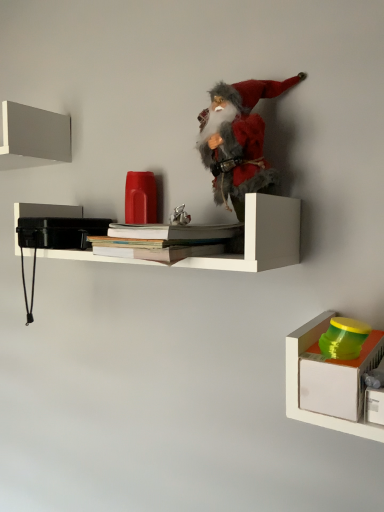
The image size is (384, 512). What do you see at coordinates (33, 137) in the screenshot?
I see `matte gray shelf at upper left, the first shelf positioned from the left` at bounding box center [33, 137].

The width and height of the screenshot is (384, 512). What do you see at coordinates (174, 231) in the screenshot? I see `white paper book at center, which appears as the second book when ordered from the bottom` at bounding box center [174, 231].

How much space does fuzzy fabric santa at center, which ranks as the first toy in top-to-bottom order, occupy horizontally?

fuzzy fabric santa at center, which ranks as the first toy in top-to-bottom order, is 13.92 centimeters in width.

How much space does hardcover books at center, placed as the 1th book when sorted from bottom to top, occupy horizontally?

hardcover books at center, placed as the 1th book when sorted from bottom to top, is 9.11 inches wide.

Find the location of a particular element. The image size is (384, 512). matte gray shelf at upper left, the first shelf positioned from the left is located at coordinates (33, 137).

From the image's perspective, between white paper book at center, which appears as the second book when ordered from the bottom, and hardcover books at center, placed as the 1th book when sorted from bottom to top, which one is located above?

white paper book at center, which appears as the second book when ordered from the bottom, is shown above in the image.

Which object is closer to the camera, white paper book at center, the 1th book in the top-to-bottom sequence, or hardcover books at center, placed as the 1th book when sorted from bottom to top?

white paper book at center, the 1th book in the top-to-bottom sequence, is more forward.

Could you tell me if white paper book at center, the 1th book in the top-to-bottom sequence, is turned towards hardcover books at center, the second book viewed from the top?

No.

In the scene shown: Which is closer to the camera, (x=139, y=224) or (x=153, y=249)?

Clearly, point (x=139, y=224) is more distant from the camera than point (x=153, y=249).

From a real-world perspective, which object rests below the other?

green plastic container at lower right, which is the 1th toy from bottom to top, from a real-world perspective.

Considering the sizes of objects green plastic container at lower right, the second toy from the top, and matte gray shelf at upper left, the 3th shelf viewed from the right, in the image provided, who is shorter, green plastic container at lower right, the second toy from the top, or matte gray shelf at upper left, the 3th shelf viewed from the right,?

With less height is green plastic container at lower right, the second toy from the top.

Locate an element on the screen. toy that is the 2nd object located below the matte gray shelf at upper left, which is the third shelf in bottom-to-top order (from the image's perspective) is located at coordinates (344, 338).

Which is less distant, (346, 337) or (4, 146)?

Point (346, 337).

Considering the sizes of objects matte white box at lower right, placed as the first shelf when sorted from right to left, and white paper book at center, which appears as the second book when ordered from the bottom, in the image provided, who is smaller, matte white box at lower right, placed as the first shelf when sorted from right to left, or white paper book at center, which appears as the second book when ordered from the bottom,?

With smaller size is white paper book at center, which appears as the second book when ordered from the bottom.

From the image's perspective, is matte white box at lower right, placed as the first shelf when sorted from right to left, above or below white paper book at center, the 1th book in the top-to-bottom sequence?

Based on their image positions, matte white box at lower right, placed as the first shelf when sorted from right to left, is located beneath white paper book at center, the 1th book in the top-to-bottom sequence.

From a real-world perspective, which object stands above the other?

In real-world perspective, white paper book at center, which appears as the second book when ordered from the bottom, is above.

Is matte white box at lower right, placed as the first shelf when sorted from right to left, facing away from white paper book at center, which appears as the second book when ordered from the bottom?

No.

Looking at their sizes, would you say green plastic container at lower right, the 2th toy positioned from the back, is wider or thinner than hardcover books at center, the second book viewed from the top?

Considering their sizes, green plastic container at lower right, the 2th toy positioned from the back, looks slimmer than hardcover books at center, the second book viewed from the top.

Considering the sizes of objects green plastic container at lower right, the 2th toy positioned from the back, and hardcover books at center, the second book viewed from the top, in the image provided, who is bigger, green plastic container at lower right, the 2th toy positioned from the back, or hardcover books at center, the second book viewed from the top,?

Bigger between the two is hardcover books at center, the second book viewed from the top.

From the image's perspective, would you say green plastic container at lower right, the second toy from the top, is shown under hardcover books at center, the second book viewed from the top?

Correct, green plastic container at lower right, the second toy from the top, appears lower than hardcover books at center, the second book viewed from the top, in the image.

In the image, is green plastic container at lower right, the first toy from the front, on the left side or the right side of hardcover books at center, placed as the 1th book when sorted from bottom to top?

In the image, green plastic container at lower right, the first toy from the front, appears on the right side of hardcover books at center, placed as the 1th book when sorted from bottom to top.

In the scene shown: From the image's perspective, is white matte shelf at center, which is the 2th shelf from right to left, over green plastic container at lower right, the first toy from the front?

Yes, from the image's perspective, white matte shelf at center, which is the 2th shelf from right to left, is over green plastic container at lower right, the first toy from the front.

Is white matte shelf at center, positioned as the 2th shelf in left-to-right order, positioned with its back to green plastic container at lower right, the 2th toy positioned from the back?

No, white matte shelf at center, positioned as the 2th shelf in left-to-right order, is not facing away from green plastic container at lower right, the 2th toy positioned from the back.

Considering their positions, is white matte shelf at center, positioned as the 2th shelf in left-to-right order, located in front of or behind green plastic container at lower right, which is the 1th toy from bottom to top?

white matte shelf at center, positioned as the 2th shelf in left-to-right order, is behind green plastic container at lower right, which is the 1th toy from bottom to top.

What's the angular difference between white matte shelf at center, arranged as the 2th shelf when viewed from the top, and green plastic container at lower right, the second toy from the top,'s facing directions?

The facing directions of white matte shelf at center, arranged as the 2th shelf when viewed from the top, and green plastic container at lower right, the second toy from the top, are 0.574 degrees apart.

From a real-world perspective, does matte white box at lower right, which appears as the first shelf when ordered from the bottom, sit lower than hardcover books at center, the second book viewed from the top?

Yes.

Considering the relative sizes of matte white box at lower right, placed as the first shelf when sorted from right to left, and hardcover books at center, placed as the 1th book when sorted from bottom to top, in the image provided, is matte white box at lower right, placed as the first shelf when sorted from right to left, wider than hardcover books at center, placed as the 1th book when sorted from bottom to top,?

No.

Could you tell me if matte white box at lower right, which appears as the first shelf when ordered from the bottom, is facing hardcover books at center, placed as the 1th book when sorted from bottom to top?

No, matte white box at lower right, which appears as the first shelf when ordered from the bottom, is not oriented towards hardcover books at center, placed as the 1th book when sorted from bottom to top.

Is matte white box at lower right, which appears as the 3th shelf when viewed from the left, positioned beyond the bounds of hardcover books at center, placed as the 1th book when sorted from bottom to top?

matte white box at lower right, which appears as the 3th shelf when viewed from the left, lies outside hardcover books at center, placed as the 1th book when sorted from bottom to top,'s area.

From a real-world perspective, is hardcover books at center, the second book viewed from the top, over matte gray shelf at upper left, acting as the first shelf starting from the top?

No, from a real-world perspective, hardcover books at center, the second book viewed from the top, is not over matte gray shelf at upper left, acting as the first shelf starting from the top

Is hardcover books at center, the second book viewed from the top, not close to matte gray shelf at upper left, acting as the first shelf starting from the top?

No, there isn't a large distance between hardcover books at center, the second book viewed from the top, and matte gray shelf at upper left, acting as the first shelf starting from the top.

Which point is more distant from viewer, (108, 254) or (27, 106)?

The point (27, 106) is farther.

Is hardcover books at center, the second book viewed from the top, to the right of matte gray shelf at upper left, the 3th shelf viewed from the right, from the viewer's perspective?

Indeed, hardcover books at center, the second book viewed from the top, is positioned on the right side of matte gray shelf at upper left, the 3th shelf viewed from the right.

Where is `book behind the white paper book at center, the 1th book in the top-to-bottom sequence`? book behind the white paper book at center, the 1th book in the top-to-bottom sequence is located at coordinates (157, 251).

Identify the location of the 2nd toy below when counting from the matte gray shelf at upper left, the 3th shelf viewed from the right (from the image's perspective). click(x=344, y=338).

Looking at the image, which one is located further to fuzzy fabric santa at center, which is the first toy in back-to-front order, matte gray shelf at upper left, acting as the first shelf starting from the top, or green plastic container at lower right, which is the 1th toy from bottom to top?

Among the two, matte gray shelf at upper left, acting as the first shelf starting from the top, is located further to fuzzy fabric santa at center, which is the first toy in back-to-front order.

Based on their spatial positions, is fuzzy fabric santa at center, which is the first toy in back-to-front order, or white paper book at center, which appears as the second book when ordered from the bottom, closer to green plastic container at lower right, placed as the first toy when sorted from right to left?

Based on the image, white paper book at center, which appears as the second book when ordered from the bottom, appears to be nearer to green plastic container at lower right, placed as the first toy when sorted from right to left.

Considering their positions, is matte white box at lower right, which appears as the 3th shelf when viewed from the left, positioned further to matte gray shelf at upper left, which is the third shelf in bottom-to-top order, than fuzzy fabric santa at center, which ranks as the first toy in top-to-bottom order?

Based on the image, matte white box at lower right, which appears as the 3th shelf when viewed from the left, appears to be further to matte gray shelf at upper left, which is the third shelf in bottom-to-top order.

Which object lies further to the anchor point fuzzy fabric santa at center, the second toy from the bottom, white paper book at center, the 1th book in the top-to-bottom sequence, or white matte shelf at center, the 2th shelf positioned from the bottom?

The object further to fuzzy fabric santa at center, the second toy from the bottom, is white matte shelf at center, the 2th shelf positioned from the bottom.

When comparing their distances from fuzzy fabric santa at center, which ranks as the first toy in top-to-bottom order, does hardcover books at center, the second book viewed from the top, or green plastic container at lower right, which is the 1th toy from bottom to top, seem further?

Based on the image, green plastic container at lower right, which is the 1th toy from bottom to top, appears to be further to fuzzy fabric santa at center, which ranks as the first toy in top-to-bottom order.

When comparing their distances from fuzzy fabric santa at center, which is the second toy in right-to-left order, does matte gray shelf at upper left, acting as the first shelf starting from the top, or hardcover books at center, placed as the 1th book when sorted from bottom to top, seem further?

matte gray shelf at upper left, acting as the first shelf starting from the top.

Looking at the image, which one is located closer to matte gray shelf at upper left, the first shelf positioned from the left, green plastic container at lower right, placed as the first toy when sorted from right to left, or matte white box at lower right, which appears as the 3th shelf when viewed from the left?

matte white box at lower right, which appears as the 3th shelf when viewed from the left, lies closer to matte gray shelf at upper left, the first shelf positioned from the left, than the other object.

When comparing their distances from white paper book at center, the 1th book in the top-to-bottom sequence, does white matte shelf at center, which is the 2th shelf from right to left, or matte gray shelf at upper left, which is the third shelf in bottom-to-top order, seem closer?

Based on the image, white matte shelf at center, which is the 2th shelf from right to left, appears to be nearer to white paper book at center, the 1th book in the top-to-bottom sequence.

You are a GUI agent. You are given a task and a screenshot of the screen. Output one action in this format:
    pyautogui.click(x=<x>, y=<y>)
    Task: Click on the shelf between fuzzy fabric santa at center, which is the first toy in back-to-front order, and matte white box at lower right, which appears as the 3th shelf when viewed from the left, vertically
    Image resolution: width=384 pixels, height=512 pixels.
    Given the screenshot: What is the action you would take?
    pyautogui.click(x=260, y=238)

This screenshot has width=384, height=512. What are the coordinates of `book between fuzzy fabric santa at center, which is the first toy in back-to-front order, and hardcover books at center, the second book viewed from the top, from top to bottom` in the screenshot? It's located at (174, 231).

Where is `book between hardcover books at center, the second book viewed from the top, and matte white box at lower right, the third shelf when ordered from top to bottom`? This screenshot has width=384, height=512. book between hardcover books at center, the second book viewed from the top, and matte white box at lower right, the third shelf when ordered from top to bottom is located at coordinates (174, 231).

Identify the location of book between matte gray shelf at upper left, the 3th shelf viewed from the right, and white paper book at center, which appears as the second book when ordered from the bottom, in the horizontal direction. (157, 251).